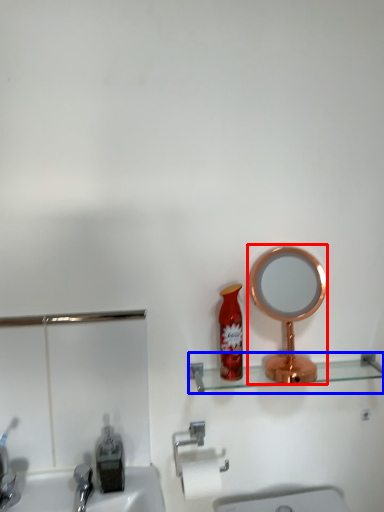
Question: Which point is closer to the camera, mirror (highlighted by a red box) or shelve (highlighted by a blue box)?

Choices:
 (A) mirror
 (B) shelve

Answer: (A)